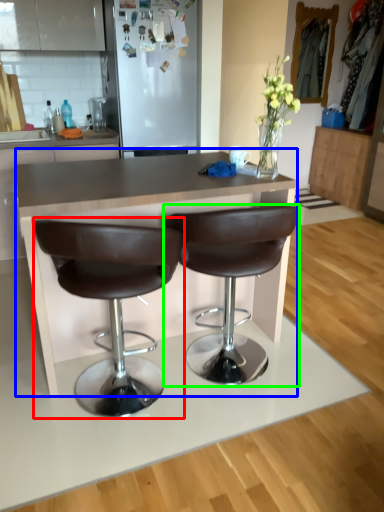
Question: Estimate the real-world distances between objects in this image. Which object is closer to chair (highlighted by a red box), table (highlighted by a blue box) or chair (highlighted by a green box)?

Choices:
 (A) table
 (B) chair

Answer: (A)